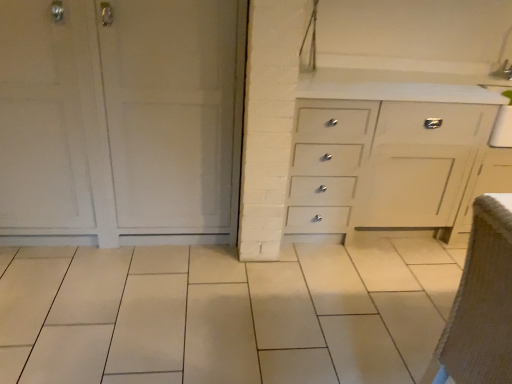
Question: From a real-world perspective, is brown fabric armchair at lower right positioned under white matte cabinet at left based on gravity?

Choices:
 (A) no
 (B) yes

Answer: (B)

Question: Considering the relative sizes of brown fabric armchair at lower right and white matte cabinet at left in the image provided, is brown fabric armchair at lower right taller than white matte cabinet at left?

Choices:
 (A) no
 (B) yes

Answer: (A)

Question: Does brown fabric armchair at lower right have a smaller size compared to white matte cabinet at left?

Choices:
 (A) yes
 (B) no

Answer: (A)

Question: From the image's perspective, does brown fabric armchair at lower right appear higher than white matte cabinet at left?

Choices:
 (A) no
 (B) yes

Answer: (A)

Question: From a real-world perspective, is brown fabric armchair at lower right on top of white matte cabinet at left?

Choices:
 (A) no
 (B) yes

Answer: (A)

Question: Is white matte cabinet at left located within brown fabric armchair at lower right?

Choices:
 (A) yes
 (B) no

Answer: (B)

Question: Does white matte cabinet at left have a lesser width compared to brown fabric armchair at lower right?

Choices:
 (A) no
 (B) yes

Answer: (A)

Question: Considering the relative sizes of white matte cabinet at left and brown fabric armchair at lower right in the image provided, is white matte cabinet at left taller than brown fabric armchair at lower right?

Choices:
 (A) no
 (B) yes

Answer: (B)

Question: From the image's perspective, is white matte cabinet at left under brown fabric armchair at lower right?

Choices:
 (A) no
 (B) yes

Answer: (A)

Question: Is white matte cabinet at left not within brown fabric armchair at lower right?

Choices:
 (A) yes
 (B) no

Answer: (A)

Question: Can you confirm if white matte cabinet at left is positioned to the right of brown fabric armchair at lower right?

Choices:
 (A) yes
 (B) no

Answer: (B)

Question: Is white matte cabinet at left far from brown fabric armchair at lower right?

Choices:
 (A) no
 (B) yes

Answer: (B)

Question: From the image's perspective, relative to white matte cabinet at left, is brown fabric armchair at lower right above or below?

Choices:
 (A) above
 (B) below

Answer: (B)